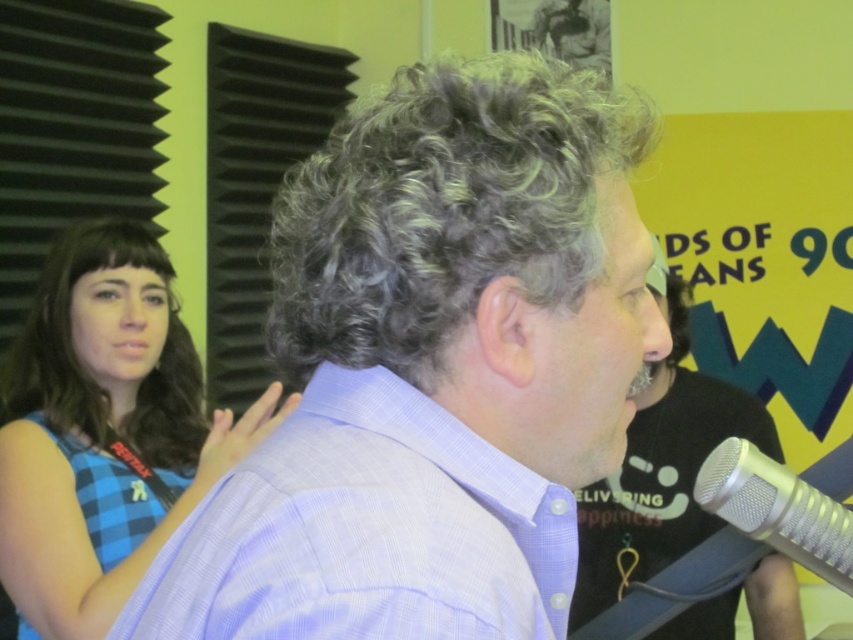
Question: Is blue shiny hair at left positioned behind silver metallic microphone at lower right?

Choices:
 (A) no
 (B) yes

Answer: (B)

Question: Which object appears farthest from the camera in this image?

Choices:
 (A) silver metallic microphone at lower right
 (B) gray curly hair at center
 (C) blue checkered dress at upper left
 (D) light blue shirt at center

Answer: (D)

Question: Which object appears closest to the camera in this image?

Choices:
 (A) light blue shirt at center
 (B) light blue plaid shirt at center
 (C) gray curly hair at center
 (D) blue shiny hair at left

Answer: (B)

Question: Which of the following is the closest to the observer?

Choices:
 (A) (138, 410)
 (B) (819, 566)

Answer: (B)

Question: Does light blue checkered shirt at center appear over blue checkered shirt at left?

Choices:
 (A) no
 (B) yes

Answer: (B)

Question: Is blue shiny hair at left to the right of silver metallic microphone at lower right from the viewer's perspective?

Choices:
 (A) no
 (B) yes

Answer: (A)